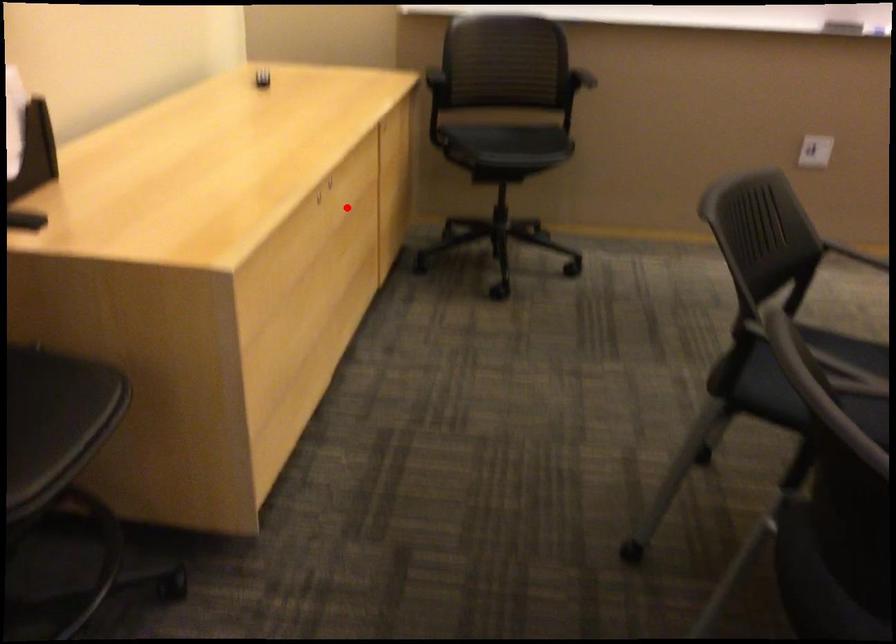
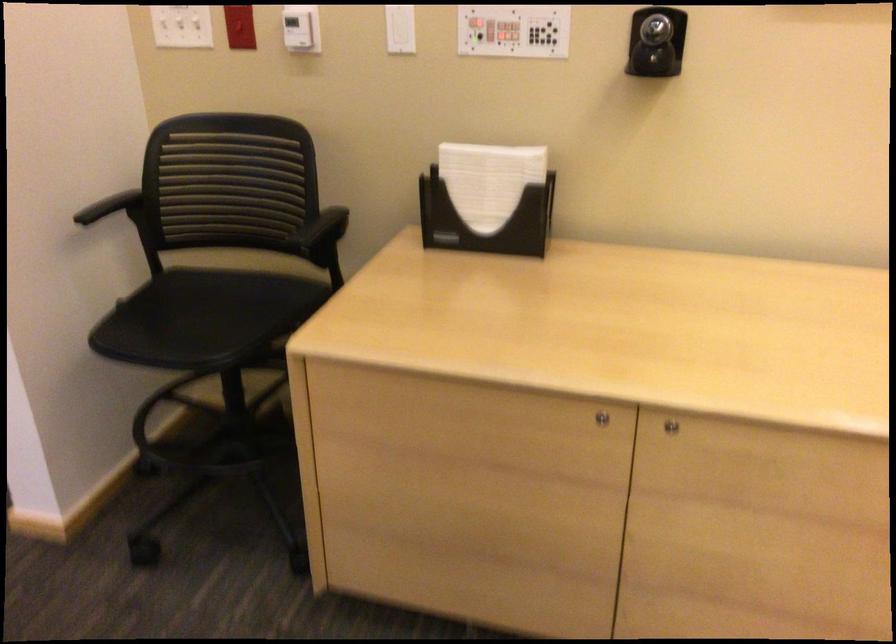
Question: A red point is marked in image1. In image2, is the corresponding 3D point closer to the camera or farther? Reply with the corresponding letter.

Choices:
 (A) The corresponding 3D point is closer.
 (B) The corresponding 3D point is farther.

Answer: (A)